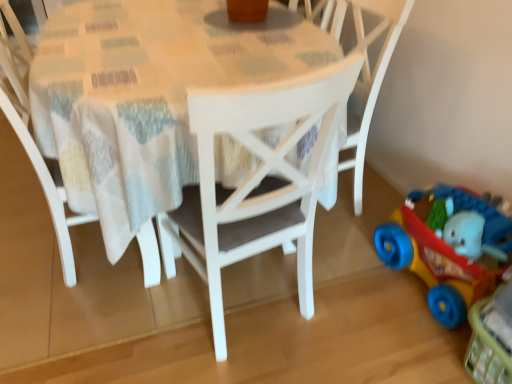
Question: From the image's perspective, is white matte chair at center, which is the 1th chair from right to left, over rubberized plastic toy car at lower right?

Choices:
 (A) yes
 (B) no

Answer: (A)

Question: Is white matte chair at center, positioned as the 2th chair in left-to-right order, positioned in front of rubberized plastic toy car at lower right?

Choices:
 (A) yes
 (B) no

Answer: (B)

Question: Can you confirm if white matte chair at center, positioned as the 2th chair in left-to-right order, is smaller than rubberized plastic toy car at lower right?

Choices:
 (A) no
 (B) yes

Answer: (A)

Question: From a real-world perspective, does white matte chair at center, which is the 1th chair from right to left, stand above rubberized plastic toy car at lower right?

Choices:
 (A) no
 (B) yes

Answer: (B)

Question: Is white matte chair at center, positioned as the 2th chair in left-to-right order, thinner than rubberized plastic toy car at lower right?

Choices:
 (A) yes
 (B) no

Answer: (B)

Question: Is white matte chair at center, positioned as the 2th chair in left-to-right order, positioned behind rubberized plastic toy car at lower right?

Choices:
 (A) yes
 (B) no

Answer: (A)

Question: From the image's perspective, is rubberized plastic toy car at lower right located above white painted wood table at center?

Choices:
 (A) no
 (B) yes

Answer: (A)

Question: Would you say rubberized plastic toy car at lower right contains white painted wood table at center?

Choices:
 (A) no
 (B) yes

Answer: (A)

Question: Is rubberized plastic toy car at lower right oriented towards white painted wood table at center?

Choices:
 (A) yes
 (B) no

Answer: (B)

Question: Is rubberized plastic toy car at lower right behind white painted wood table at center?

Choices:
 (A) yes
 (B) no

Answer: (A)

Question: Is rubberized plastic toy car at lower right taller than white painted wood table at center?

Choices:
 (A) yes
 (B) no

Answer: (B)

Question: Is rubberized plastic toy car at lower right to the right of white painted wood table at center from the viewer's perspective?

Choices:
 (A) yes
 (B) no

Answer: (A)

Question: Are white matte chair at center, arranged as the first chair when viewed from the left, and rubberized plastic toy car at lower right beside each other?

Choices:
 (A) yes
 (B) no

Answer: (B)